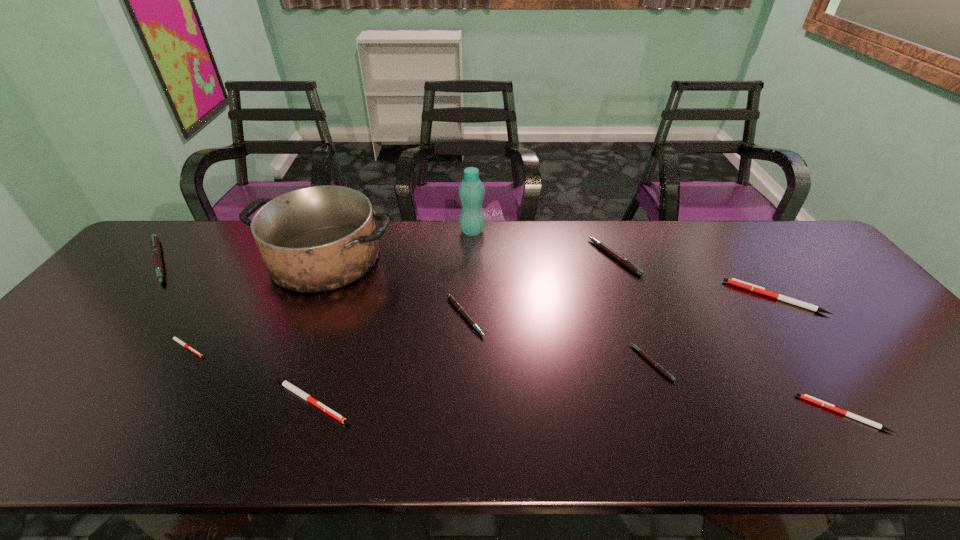
I want to click on free space that is in between the fourth pen from left to right and the third biggest white pen, so click(654, 365).

Identify the location of free space between the second smallest white pen and the nearest pink pen. This screenshot has width=960, height=540. (747, 388).

The image size is (960, 540). Find the location of `free spot between the third pen from left to right and the third biggest white pen`. free spot between the third pen from left to right and the third biggest white pen is located at coordinates (577, 407).

Locate an element on the screen. unoccupied position between the biggest pink pen and the third pen from left to right is located at coordinates (234, 331).

You are a GUI agent. You are given a task and a screenshot of the screen. Output one action in this format:
    pyautogui.click(x=<x>, y=<y>)
    Task: Click on the free area in between the third smallest white pen and the biggest white pen
    The width and height of the screenshot is (960, 540).
    Given the screenshot: What is the action you would take?
    click(x=542, y=349)

The width and height of the screenshot is (960, 540). I want to click on empty location between the farthest white pen and the saucepan, so click(550, 278).

The width and height of the screenshot is (960, 540). I want to click on free area in between the ninth shortest object and the nearest pink pen, so click(489, 310).

Locate an element on the screen. The width and height of the screenshot is (960, 540). unoccupied area between the second smallest white pen and the bottle is located at coordinates (658, 322).

Find the location of a particular element. blank region between the seventh pen from right to left and the farthest white pen is located at coordinates (481, 322).

You are a GUI agent. You are given a task and a screenshot of the screen. Output one action in this format:
    pyautogui.click(x=<x>, y=<y>)
    Task: Click on the object that stands as the closest to the third smallest pink pen
    The image size is (960, 540).
    Given the screenshot: What is the action you would take?
    pyautogui.click(x=733, y=281)